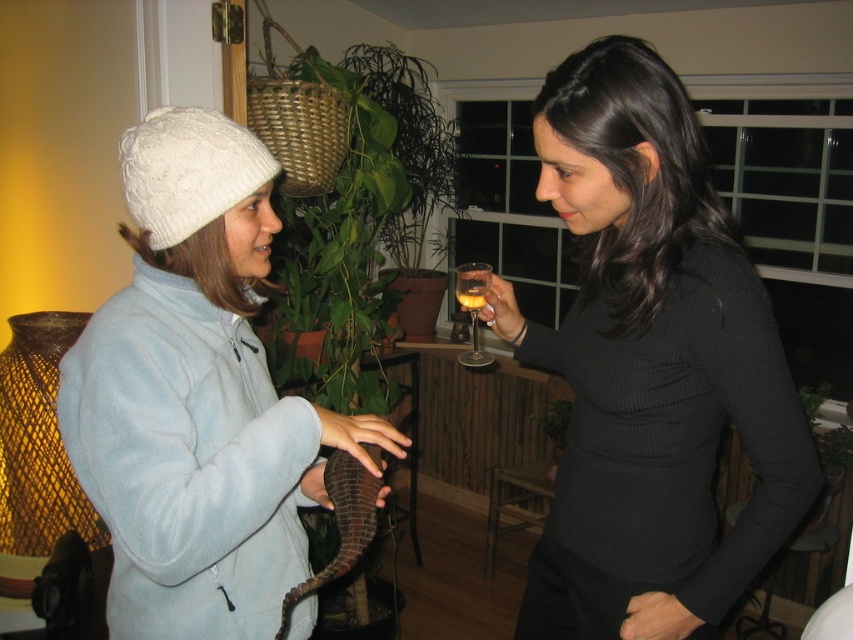
Question: Is black ribbed sweater at upper right thinner than translucent glass at upper center?

Choices:
 (A) no
 (B) yes

Answer: (A)

Question: Estimate the real-world distances between objects in this image. Which object is farther from the white fuzzy hat at left?

Choices:
 (A) black ribbed sweater at upper right
 (B) translucent glass wine glass at center

Answer: (B)

Question: Which object is positioned closest to the black ribbed sweater at upper right?

Choices:
 (A) white fuzzy hat at left
 (B) translucent glass at upper center
 (C) translucent glass wine glass at center

Answer: (C)

Question: Does black ribbed sweater at upper right appear on the left side of white fuzzy hat at left?

Choices:
 (A) no
 (B) yes

Answer: (A)

Question: Can you confirm if black ribbed sweater at upper right is positioned below translucent glass wine glass at center?

Choices:
 (A) no
 (B) yes

Answer: (B)

Question: Which of these objects is positioned farthest from the translucent glass at upper center?

Choices:
 (A) black ribbed sweater at upper right
 (B) white fuzzy hat at left

Answer: (B)